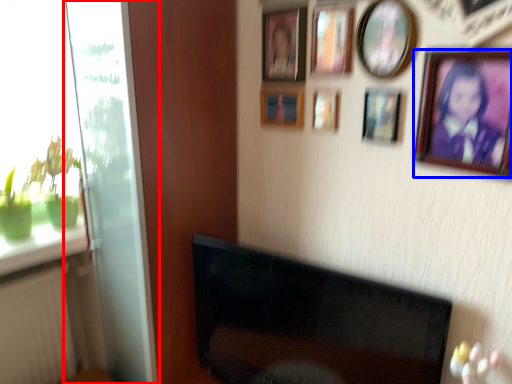
Question: Which object is further to the camera taking this photo, glass door (highlighted by a red box) or picture frame (highlighted by a blue box)?

Choices:
 (A) glass door
 (B) picture frame

Answer: (A)